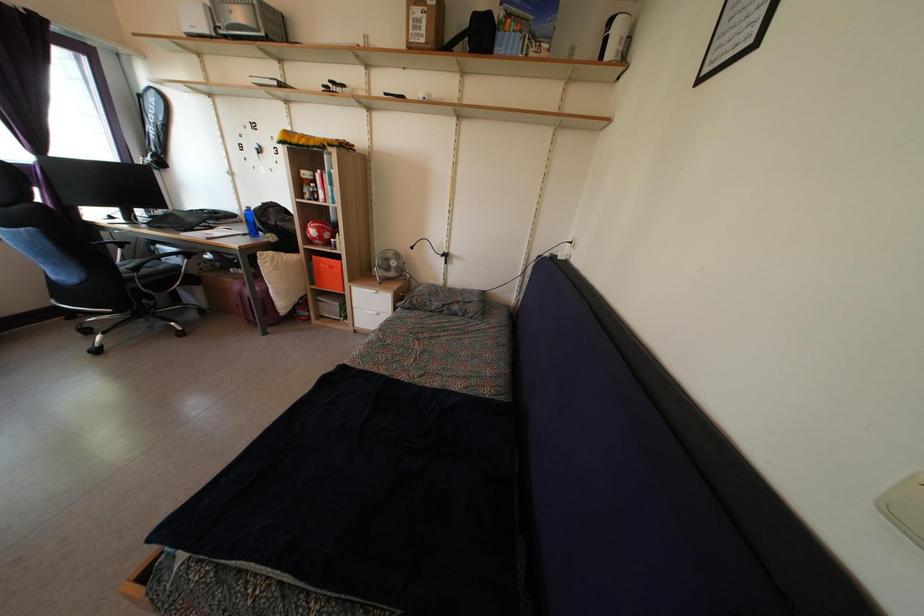
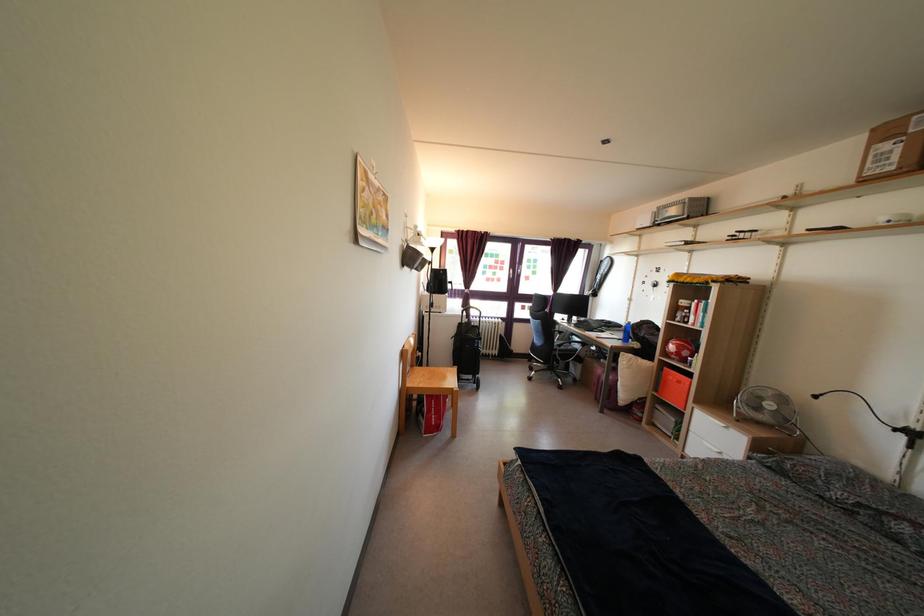
Question: The camera is either moving clockwise (left) or counter-clockwise (right) around the object. The first image is from the beginning of the video and the second image is from the end. Is the camera moving left or right when shooting the video?

Choices:
 (A) Left
 (B) Right

Answer: (B)